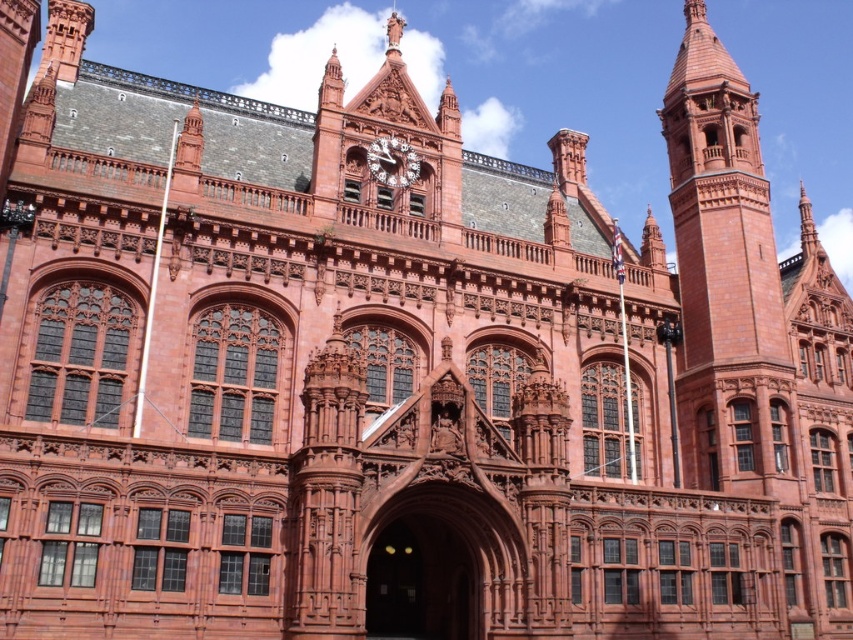
Does smooth stone archway at center appear over polished brass clock at center?

Incorrect, smooth stone archway at center is not positioned above polished brass clock at center.

Based on the photo, who is higher up, smooth stone archway at center or polished brass clock at center?

polished brass clock at center

The height and width of the screenshot is (640, 853). What do you see at coordinates (419, 580) in the screenshot? I see `smooth stone archway at center` at bounding box center [419, 580].

You are a GUI agent. You are given a task and a screenshot of the screen. Output one action in this format:
    pyautogui.click(x=<x>, y=<y>)
    Task: Click on the smooth stone archway at center
    
    Given the screenshot: What is the action you would take?
    pyautogui.click(x=419, y=580)